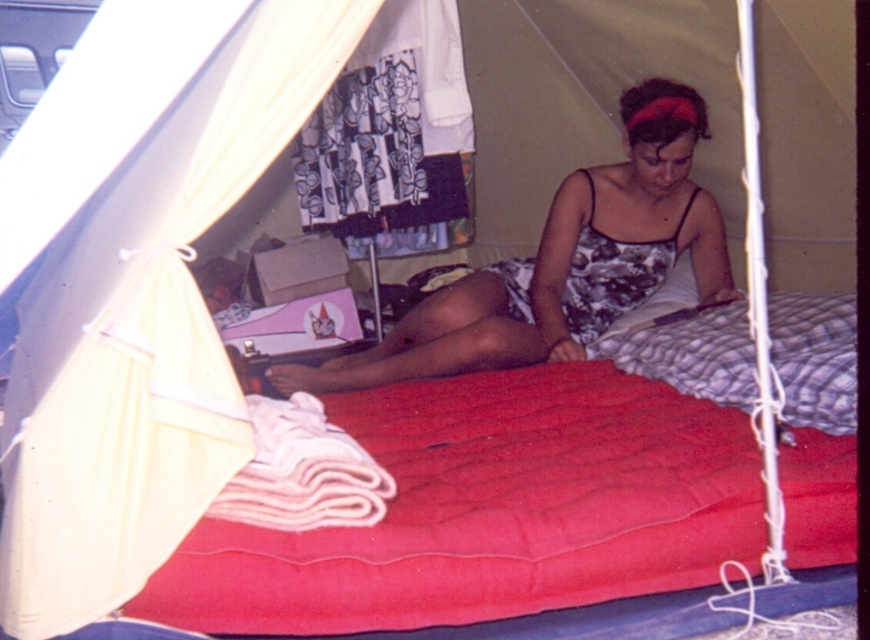
Question: Does red quilted mattress at center have a smaller size compared to printed fabric dress at center?

Choices:
 (A) no
 (B) yes

Answer: (A)

Question: Can you confirm if red quilted mattress at center is positioned below printed fabric dress at center?

Choices:
 (A) no
 (B) yes

Answer: (B)

Question: Is red quilted mattress at center positioned at the back of printed fabric dress at center?

Choices:
 (A) no
 (B) yes

Answer: (A)